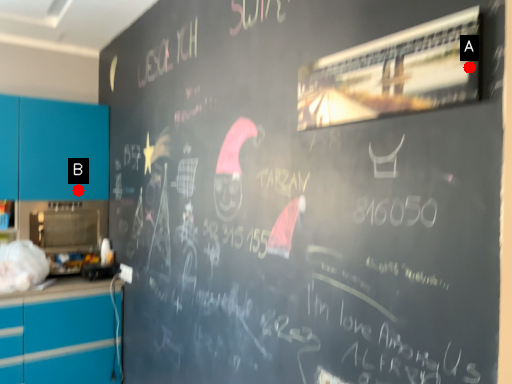
Question: Two points are circled on the image, labeled by A and B beside each circle. Among these points, which one is nearest to the camera?

Choices:
 (A) A is closer
 (B) B is closer

Answer: (A)